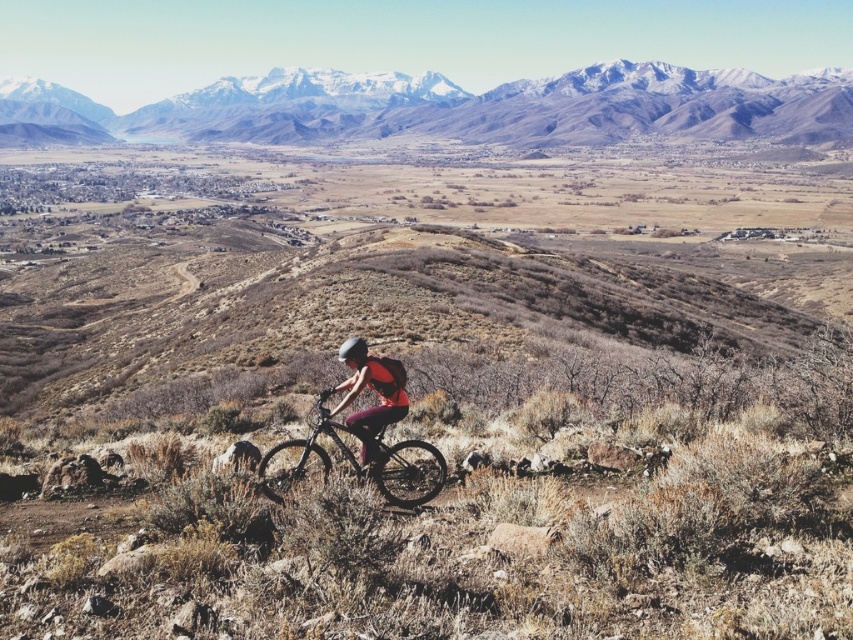
Question: Does shiny black frame at center have a smaller size compared to matte pink shorts at center?

Choices:
 (A) yes
 (B) no

Answer: (A)

Question: Estimate the real-world distances between objects in this image. Which object is closer to the snowy rocky mountain at upper center?

Choices:
 (A) matte pink shorts at center
 (B) shiny black frame at center

Answer: (B)

Question: Is shiny black frame at center to the right of matte pink shorts at center from the viewer's perspective?

Choices:
 (A) yes
 (B) no

Answer: (A)

Question: Does snowy rocky mountain at upper center appear on the right side of matte pink shorts at center?

Choices:
 (A) yes
 (B) no

Answer: (B)

Question: Which of the following is the farthest from the observer?

Choices:
 (A) snowy rocky mountain at upper center
 (B) matte pink shorts at center

Answer: (A)

Question: Which object is positioned farthest from the shiny black frame at center?

Choices:
 (A) matte pink shorts at center
 (B) snowy rocky mountain at upper center

Answer: (B)